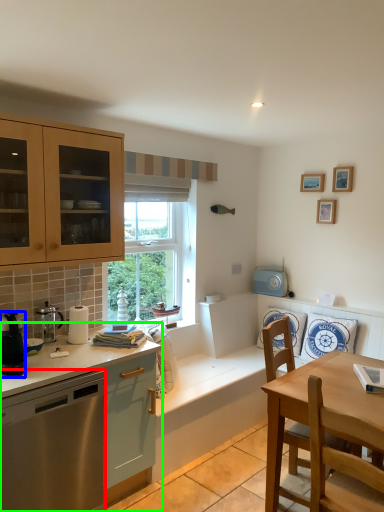
Question: Which object is the farthest from dishwasher (highlighted by a red box)? Choose among these: kitchen appliance (highlighted by a blue box) or countertop (highlighted by a green box).

Choices:
 (A) kitchen appliance
 (B) countertop

Answer: (A)